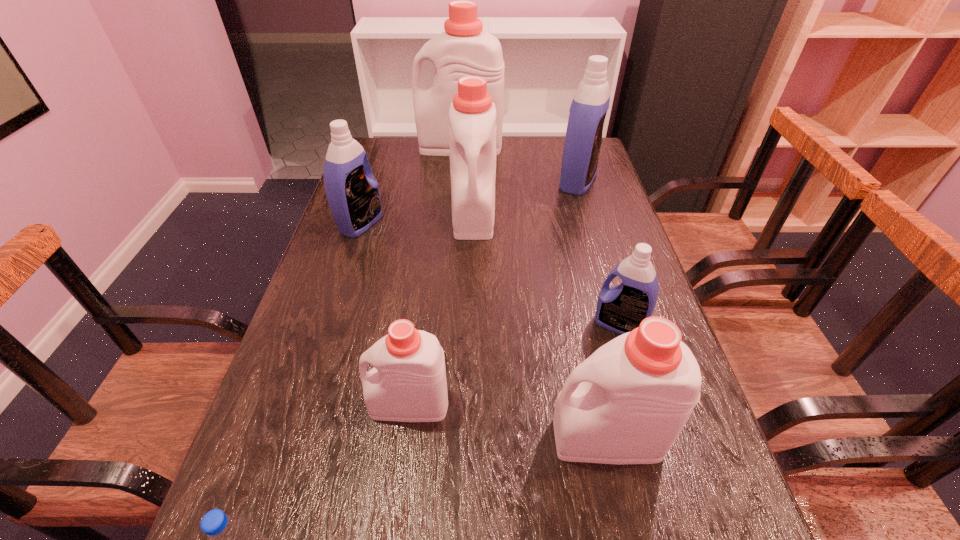
What are the coordinates of `object that is the fourth closest to the rightmost white detergent` in the screenshot? It's located at (472, 116).

Identify the location of detergent identified as the sixth closest to the tallest object. Image resolution: width=960 pixels, height=540 pixels. (627, 403).

Locate an element on the screen. This screenshot has height=540, width=960. detergent identified as the fourth closest to the leftmost blue detergent is located at coordinates (583, 139).

Identify which white detergent is the second closest to the rightmost white detergent. Please provide its 2D coordinates. Your answer should be formatted as a tuple, i.e. [(x, y)], where the tuple contains the x and y coordinates of a point satisfying the conditions above.

[(472, 116)]

Select which white detergent appears as the second closest to the second nearest blue detergent. Please provide its 2D coordinates. Your answer should be formatted as a tuple, i.e. [(x, y)], where the tuple contains the x and y coordinates of a point satisfying the conditions above.

[(464, 49)]

Select which blue detergent appears as the third closest to the smallest white detergent. Please provide its 2D coordinates. Your answer should be formatted as a tuple, i.e. [(x, y)], where the tuple contains the x and y coordinates of a point satisfying the conditions above.

[(583, 139)]

Where is `blue detergent that is the nearest to the third biggest white detergent`? The width and height of the screenshot is (960, 540). blue detergent that is the nearest to the third biggest white detergent is located at coordinates (621, 309).

This screenshot has width=960, height=540. Identify the location of vacant space that satisfies the following two spatial constraints: 1. on the handle side of the farthest white detergent; 2. on the right side of the biggest blue detergent. (458, 181).

The width and height of the screenshot is (960, 540). What are the coordinates of `vacant space that satisfies the following two spatial constraints: 1. on the handle side of the tallest detergent; 2. on the left side of the nearest blue detergent` in the screenshot? It's located at (448, 325).

Where is `vacant area in the image that satisfies the following two spatial constraints: 1. on the back side of the biggest blue detergent; 2. on the handle side of the biggest white detergent`? This screenshot has height=540, width=960. vacant area in the image that satisfies the following two spatial constraints: 1. on the back side of the biggest blue detergent; 2. on the handle side of the biggest white detergent is located at coordinates (567, 146).